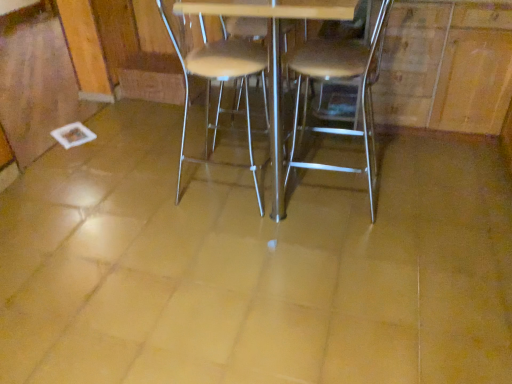
Find the location of a particular element. The image size is (512, 384). free point to the left of metallic silver chair at center, the first chair positioned from the right is located at coordinates (255, 205).